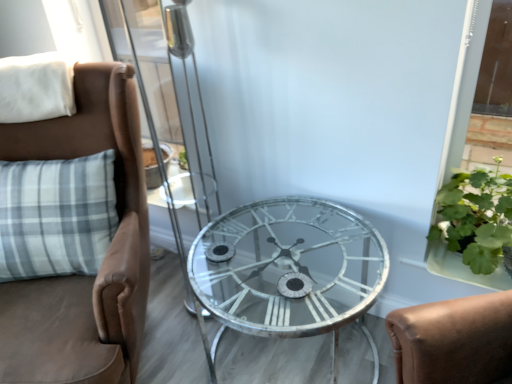
This screenshot has width=512, height=384. I want to click on vacant area to the left of metallic silver clock face at center, so click(229, 291).